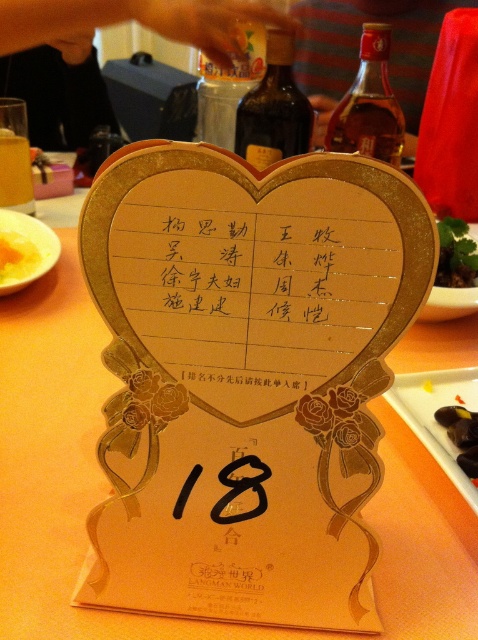
Question: Which point is closer to the camera?

Choices:
 (A) black glossy food at lower right
 (B) yellow soft-boiled egg at center
 (C) green leafy vegetable at right

Answer: (A)

Question: Does yellow matte plate at lower left come behind black paper at center?

Choices:
 (A) no
 (B) yes

Answer: (B)

Question: Estimate the real-world distances between objects in this image. Which object is closer to the white plastic tray at lower right?

Choices:
 (A) green leafy vegetable at right
 (B) black paper at center
 (C) black glossy food at lower right

Answer: (C)

Question: Does yellow matte plate at lower left come behind black paper at center?

Choices:
 (A) yes
 (B) no

Answer: (A)

Question: Which point appears closest to the camera in this image?

Choices:
 (A) (24, 268)
 (B) (21, 257)
 (C) (445, 428)
 (D) (438, 278)

Answer: (C)

Question: Is white plastic tray at lower right thinner than black glossy food at lower right?

Choices:
 (A) yes
 (B) no

Answer: (B)